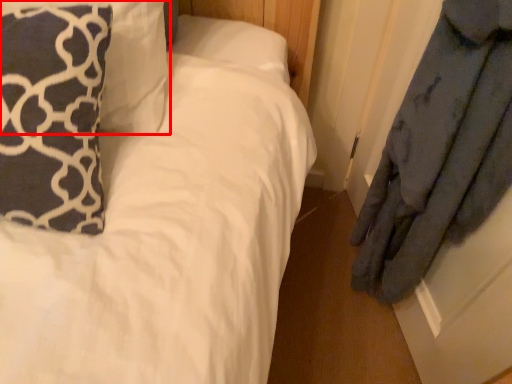
Question: From the image's perspective, where is pillow (annotated by the red box) located relative to pillow?

Choices:
 (A) above
 (B) below

Answer: (A)